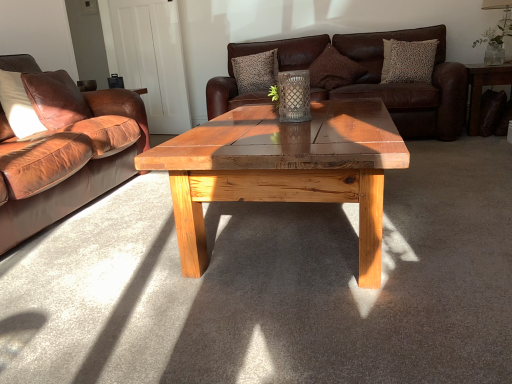
The image size is (512, 384). Find the location of `matte white lampshade at upper right`. matte white lampshade at upper right is located at coordinates (500, 8).

What is the approximate height of brown leather couch at left, marked as the 1th studio couch in a left-to-right arrangement?

brown leather couch at left, marked as the 1th studio couch in a left-to-right arrangement, is 87.64 centimeters in height.

What do you see at coordinates (496, 33) in the screenshot? I see `clear glass vase at upper right` at bounding box center [496, 33].

Locate an element on the screen. This screenshot has width=512, height=384. brown textured pillow at upper center, which is counted as the 3th pillow, starting from the left is located at coordinates (334, 70).

Describe the element at coordinates (334, 70) in the screenshot. I see `brown textured pillow at upper center, which is counted as the 3th pillow, starting from the left` at that location.

Identify the location of textured brown pillow at upper center, which ranks as the fourth pillow in front-to-back order. This screenshot has height=384, width=512. (255, 71).

Find the location of a particular element. The image size is (512, 384). the 3rd pillow to the left of the patterned fabric pillow at upper right, the 2th pillow when ordered from front to back, starting your count from the anchor is located at coordinates (55, 98).

From the image's perspective, relative to leather pillow at left, which is the 1th pillow from front to back, is patterned fabric pillow at upper right, the 1th pillow in the right-to-left sequence, above or below?

From the image's perspective, patterned fabric pillow at upper right, the 1th pillow in the right-to-left sequence, appears above leather pillow at left, which is the 1th pillow from front to back.

From a real-world perspective, relative to leather pillow at left, which is the 1th pillow from front to back, is patterned fabric pillow at upper right, the 2th pillow when ordered from front to back, vertically above or below?

patterned fabric pillow at upper right, the 2th pillow when ordered from front to back, is situated higher than leather pillow at left, which is the 1th pillow from front to back, in the real world.

Relative to dark brown leather side table at right, is brown leather couch at center, which is counted as the 1th studio couch, starting from the right, in front or behind?

brown leather couch at center, which is counted as the 1th studio couch, starting from the right, is in front of dark brown leather side table at right.

Consider the image. From the image's perspective, between brown leather couch at center, the second studio couch from the front, and dark brown leather side table at right, which one is located above?

brown leather couch at center, the second studio couch from the front, appears higher in the image.

From the image's perspective, which is above, clear glass vase at upper right or brown leather couch at center, which is counted as the 1th studio couch, starting from the right?

clear glass vase at upper right appears higher in the image.

Is clear glass vase at upper right shorter than brown leather couch at center, which is the first studio couch from back to front?

Yes, clear glass vase at upper right is shorter than brown leather couch at center, which is the first studio couch from back to front.

Identify the location of floral arrangement above the brown leather couch at center, which is counted as the 1th studio couch, starting from the right (from the image's perspective). (496, 33).

Is leather pillow at left, the fourth pillow viewed from the back, thinner than textured brown pillow at upper center, acting as the third pillow starting from the right?

Incorrect, the width of leather pillow at left, the fourth pillow viewed from the back, is not less than that of textured brown pillow at upper center, acting as the third pillow starting from the right.

Would you say textured brown pillow at upper center, which ranks as the fourth pillow in front-to-back order, is part of leather pillow at left, placed as the 1th pillow when sorted from left to right,'s contents?

No, textured brown pillow at upper center, which ranks as the fourth pillow in front-to-back order, is not surrounded by leather pillow at left, placed as the 1th pillow when sorted from left to right.

Considering the positions of objects leather pillow at left, which is the 1th pillow from front to back, and textured brown pillow at upper center, the first pillow positioned from the back, in the image provided, who is behind, leather pillow at left, which is the 1th pillow from front to back, or textured brown pillow at upper center, the first pillow positioned from the back,?

textured brown pillow at upper center, the first pillow positioned from the back, is behind.

From a real-world perspective, who is located lower, leather pillow at left, which appears as the fourth pillow when viewed from the right, or textured brown pillow at upper center, the first pillow positioned from the back?

In real-world perspective, leather pillow at left, which appears as the fourth pillow when viewed from the right, is lower.

Is textured brown pillow at upper center, the first pillow positioned from the back, shorter than brown leather couch at center, the second studio couch from the front?

Yes, textured brown pillow at upper center, the first pillow positioned from the back, is shorter than brown leather couch at center, the second studio couch from the front.

Looking at this image, is the surface of textured brown pillow at upper center, acting as the third pillow starting from the right, in direct contact with brown leather couch at center, the second studio couch from the front?

No, textured brown pillow at upper center, acting as the third pillow starting from the right, is not in contact with brown leather couch at center, the second studio couch from the front.

Does textured brown pillow at upper center, acting as the third pillow starting from the right, come behind brown leather couch at center, which is counted as the 1th studio couch, starting from the right?

Yes, the depth of textured brown pillow at upper center, acting as the third pillow starting from the right, is greater than that of brown leather couch at center, which is counted as the 1th studio couch, starting from the right.

Visually, is dark brown leather side table at right positioned to the left or to the right of clear glass vase at upper right?

dark brown leather side table at right is to the right of clear glass vase at upper right.

Does dark brown leather side table at right turn towards clear glass vase at upper right?

No, dark brown leather side table at right is not turned towards clear glass vase at upper right.

In the scene shown: Is dark brown leather side table at right situated inside clear glass vase at upper right or outside?

dark brown leather side table at right is outside clear glass vase at upper right.

Who is bigger, dark brown leather side table at right or clear glass vase at upper right?

With larger size is dark brown leather side table at right.

Could you tell me if brown textured pillow at upper center, which ranks as the 2th pillow in back-to-front order, is turned towards dark brown leather side table at right?

No, brown textured pillow at upper center, which ranks as the 2th pillow in back-to-front order, is not facing towards dark brown leather side table at right.

How different are the orientations of brown textured pillow at upper center, which ranks as the 2th pillow in back-to-front order, and dark brown leather side table at right in degrees?

The facing directions of brown textured pillow at upper center, which ranks as the 2th pillow in back-to-front order, and dark brown leather side table at right are 4.16 degrees apart.

Considering the relative sizes of brown textured pillow at upper center, which ranks as the 2th pillow in back-to-front order, and dark brown leather side table at right in the image provided, is brown textured pillow at upper center, which ranks as the 2th pillow in back-to-front order, smaller than dark brown leather side table at right?

Correct, brown textured pillow at upper center, which ranks as the 2th pillow in back-to-front order, occupies less space than dark brown leather side table at right.

Locate an element on the screen. The width and height of the screenshot is (512, 384). the 1st pillow behind the leather pillow at left, which appears as the fourth pillow when viewed from the right is located at coordinates (408, 61).

Locate an element on the screen. Image resolution: width=512 pixels, height=384 pixels. the 1st studio couch in front of the dark brown leather side table at right is located at coordinates 365,80.

From the image, which object appears to be farther from leather pillow at left, the fourth pillow viewed from the back, brown leather couch at left, which is the first studio couch in front-to-back order, or textured brown pillow at upper center, acting as the third pillow starting from the right?

Based on the image, textured brown pillow at upper center, acting as the third pillow starting from the right, appears to be further to leather pillow at left, the fourth pillow viewed from the back.

Estimate the real-world distances between objects in this image. Which object is further from patterned fabric pillow at upper right, the third pillow in the back-to-front sequence, textured brown pillow at upper center, acting as the 2th pillow starting from the left, or brown leather couch at center, the second studio couch from the left?

textured brown pillow at upper center, acting as the 2th pillow starting from the left.

Considering their positions, is brown leather couch at left, the 2th studio couch viewed from the right, positioned closer to matte white lampshade at upper right than dark brown leather side table at right?

Based on the image, dark brown leather side table at right appears to be nearer to matte white lampshade at upper right.

From the image, which object appears to be nearer to brown textured pillow at upper center, the second pillow positioned from the right, dark brown leather side table at right or patterned fabric pillow at upper right, the third pillow in the back-to-front sequence?

patterned fabric pillow at upper right, the third pillow in the back-to-front sequence, lies closer to brown textured pillow at upper center, the second pillow positioned from the right, than the other object.

Consider the image. Considering their positions, is clear glass vase at upper right positioned further to brown leather couch at left, marked as the 1th studio couch in a left-to-right arrangement, than dark brown leather side table at right?

Among the two, clear glass vase at upper right is located further to brown leather couch at left, marked as the 1th studio couch in a left-to-right arrangement.

Considering their positions, is dark brown leather side table at right positioned closer to brown leather couch at left, marked as the 1th studio couch in a left-to-right arrangement, than matte white lampshade at upper right?

dark brown leather side table at right is closer to brown leather couch at left, marked as the 1th studio couch in a left-to-right arrangement.

Considering their positions, is patterned fabric pillow at upper right, the third pillow in the back-to-front sequence, positioned closer to textured brown pillow at upper center, acting as the 2th pillow starting from the left, than brown textured pillow at upper center, which is the third pillow from front to back?

Among the two, brown textured pillow at upper center, which is the third pillow from front to back, is located nearer to textured brown pillow at upper center, acting as the 2th pillow starting from the left.

Estimate the real-world distances between objects in this image. Which object is closer to dark brown leather side table at right, clear glass vase at upper right or matte white lampshade at upper right?

clear glass vase at upper right lies closer to dark brown leather side table at right than the other object.

Find the location of a particular element. The image size is (512, 384). floral arrangement between brown leather couch at left, which is the first studio couch in front-to-back order, and matte white lampshade at upper right from left to right is located at coordinates (496, 33).

Locate an element on the screen. This screenshot has height=384, width=512. side table between leather pillow at left, the fourth pillow viewed from the back, and matte white lampshade at upper right from left to right is located at coordinates (482, 88).

Image resolution: width=512 pixels, height=384 pixels. I want to click on floral arrangement between patterned fabric pillow at upper right, the 1th pillow in the right-to-left sequence, and dark brown leather side table at right, in the horizontal direction, so click(496, 33).

The image size is (512, 384). In order to click on studio couch between leather pillow at left, which is the 1th pillow from front to back, and dark brown leather side table at right, in the horizontal direction in this screenshot , I will do `click(365, 80)`.